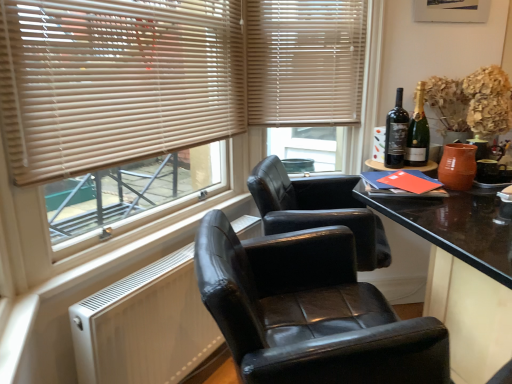
This screenshot has width=512, height=384. What are the coordinates of `beige wood blinds at upper center` in the screenshot? It's located at (305, 61).

Is beige wood blinds at upper center positioned far away from matte glass bottle at upper right, which appears as the first bottle when viewed from the right?

That's not correct — beige wood blinds at upper center is a little close to matte glass bottle at upper right, which appears as the first bottle when viewed from the right.

From the image's perspective, is beige wood blinds at upper center located above matte glass bottle at upper right, placed as the 2th bottle when sorted from left to right?

Yes, from the image's perspective, beige wood blinds at upper center is over matte glass bottle at upper right, placed as the 2th bottle when sorted from left to right.

Does point (328, 74) come closer to viewer compared to point (423, 128)?

No, (328, 74) is further to viewer.

Is beige wood blinds at upper center aimed at matte glass bottle at upper right, placed as the 2th bottle when sorted from left to right?

Yes, beige wood blinds at upper center is turned towards matte glass bottle at upper right, placed as the 2th bottle when sorted from left to right.

Is black leather chair at center to the left of beige wood blinds at upper left from the viewer's perspective?

Incorrect, black leather chair at center is not on the left side of beige wood blinds at upper left.

Which of these two, black leather chair at center or beige wood blinds at upper left, is smaller?

beige wood blinds at upper left is smaller.

Is black leather chair at center oriented away from beige wood blinds at upper left?

No, black leather chair at center is not facing away from beige wood blinds at upper left.

Which is in front, point (431, 327) or point (426, 139)?

Point (431, 327)

Between black leather chair at center and matte glass bottle at upper right, placed as the 2th bottle when sorted from left to right, which one has larger size?

black leather chair at center.

From a real-world perspective, is black leather chair at center physically below matte glass bottle at upper right, which appears as the first bottle when viewed from the right?

Yes.

Is black leather chair at center next to matte glass bottle at upper right, placed as the 2th bottle when sorted from left to right?

black leather chair at center and matte glass bottle at upper right, placed as the 2th bottle when sorted from left to right, are clearly separated.

Could you measure the distance between black glass bottle at upper right, placed as the 2th bottle when sorted from right to left, and matte glass bottle at upper right, which appears as the first bottle when viewed from the right?

They are 2.53 inches apart.

Is black glass bottle at upper right, acting as the first bottle starting from the left, placed right next to matte glass bottle at upper right, which appears as the first bottle when viewed from the right?

Absolutely, black glass bottle at upper right, acting as the first bottle starting from the left, is next to and touching matte glass bottle at upper right, which appears as the first bottle when viewed from the right.

From a real-world perspective, is black glass bottle at upper right, placed as the 2th bottle when sorted from right to left, physically below matte glass bottle at upper right, placed as the 2th bottle when sorted from left to right?

Yes, from a real-world perspective, black glass bottle at upper right, placed as the 2th bottle when sorted from right to left, is beneath matte glass bottle at upper right, placed as the 2th bottle when sorted from left to right.

Is point (400, 144) closer or farther from the camera than point (415, 135)?

Point (400, 144) is positioned closer to the camera compared to point (415, 135).

From a real-world perspective, is beige wood blinds at upper center positioned over beige wood blinds at upper left based on gravity?

Yes.

Which of these two, beige wood blinds at upper center or beige wood blinds at upper left, is bigger?

beige wood blinds at upper left is bigger.

Measure the distance between beige wood blinds at upper center and beige wood blinds at upper left.

A distance of 8.44 inches exists between beige wood blinds at upper center and beige wood blinds at upper left.

From the image's perspective, is beige wood blinds at upper center beneath beige wood blinds at upper left?

Actually, beige wood blinds at upper center appears above beige wood blinds at upper left in the image.

Based on the photo, is beige wood blinds at upper left wider or thinner than black glass bottle at upper right, acting as the first bottle starting from the left?

Considering their sizes, beige wood blinds at upper left looks slimmer than black glass bottle at upper right, acting as the first bottle starting from the left.

How different are the orientations of beige wood blinds at upper left and black glass bottle at upper right, placed as the 2th bottle when sorted from right to left, in degrees?

The angular difference between beige wood blinds at upper left and black glass bottle at upper right, placed as the 2th bottle when sorted from right to left, is 80.5 degrees.

In the scene shown: Based on their positions, is beige wood blinds at upper left located to the left or right of black glass bottle at upper right, acting as the first bottle starting from the left?

beige wood blinds at upper left is positioned on black glass bottle at upper right, acting as the first bottle starting from the left,'s left side.

Is beige wood blinds at upper left in contact with black leather chair at center?

No, beige wood blinds at upper left is not beside black leather chair at center.

From a real-world perspective, is beige wood blinds at upper left located higher than black leather chair at center?

Yes.

Considering their positions, is beige wood blinds at upper left located in front of or behind black leather chair at center?

beige wood blinds at upper left is positioned farther from the viewer than black leather chair at center.

Do you think beige wood blinds at upper left is within black leather chair at center, or outside of it?

beige wood blinds at upper left exists outside the volume of black leather chair at center.

Image resolution: width=512 pixels, height=384 pixels. In order to click on window blind behind the matte glass bottle at upper right, which appears as the first bottle when viewed from the right in this screenshot , I will do `click(305, 61)`.

Find the location of a particular element. The width and height of the screenshot is (512, 384). chair that is below the beige wood blinds at upper left (from the image's perspective) is located at coordinates (309, 311).

From the image, which object appears to be farther from black leather chair at center, beige wood blinds at upper center or black glass bottle at upper right, placed as the 2th bottle when sorted from right to left?

Among the two, beige wood blinds at upper center is located further to black leather chair at center.

Based on their spatial positions, is matte glass bottle at upper right, placed as the 2th bottle when sorted from left to right, or black leather chair at center further from black glass bottle at upper right, acting as the first bottle starting from the left?

Among the two, black leather chair at center is located further to black glass bottle at upper right, acting as the first bottle starting from the left.

Estimate the real-world distances between objects in this image. Which object is closer to matte glass bottle at upper right, placed as the 2th bottle when sorted from left to right, beige wood blinds at upper left or beige wood blinds at upper center?

beige wood blinds at upper center lies closer to matte glass bottle at upper right, placed as the 2th bottle when sorted from left to right, than the other object.

When comparing their distances from beige wood blinds at upper center, does matte glass bottle at upper right, which appears as the first bottle when viewed from the right, or black glass bottle at upper right, acting as the first bottle starting from the left, seem closer?

black glass bottle at upper right, acting as the first bottle starting from the left.

Considering their positions, is black leather chair at center positioned further to beige wood blinds at upper left than matte glass bottle at upper right, placed as the 2th bottle when sorted from left to right?

Based on the image, matte glass bottle at upper right, placed as the 2th bottle when sorted from left to right, appears to be further to beige wood blinds at upper left.

Considering their positions, is black leather chair at center positioned further to matte glass bottle at upper right, which appears as the first bottle when viewed from the right, than beige wood blinds at upper left?

The object further to matte glass bottle at upper right, which appears as the first bottle when viewed from the right, is black leather chair at center.

Considering their positions, is black glass bottle at upper right, placed as the 2th bottle when sorted from right to left, positioned further to beige wood blinds at upper left than beige wood blinds at upper center?

black glass bottle at upper right, placed as the 2th bottle when sorted from right to left, lies further to beige wood blinds at upper left than the other object.

Considering their positions, is black glass bottle at upper right, acting as the first bottle starting from the left, positioned further to black leather chair at center than matte glass bottle at upper right, which appears as the first bottle when viewed from the right?

Among the two, matte glass bottle at upper right, which appears as the first bottle when viewed from the right, is located further to black leather chair at center.

At what (x,y) coordinates should I click in order to perform the action: click on window between black leather chair at center and black glass bottle at upper right, placed as the 2th bottle when sorted from right to left, along the z-axis. Please return your answer as a coordinate pair (x, y). The width and height of the screenshot is (512, 384). Looking at the image, I should click on (163, 105).

Find the location of `bottle between beige wood blinds at upper center and matte glass bottle at upper right, which appears as the first bottle when viewed from the right`. bottle between beige wood blinds at upper center and matte glass bottle at upper right, which appears as the first bottle when viewed from the right is located at coordinates (396, 134).

In order to click on bottle between black leather chair at center and matte glass bottle at upper right, placed as the 2th bottle when sorted from left to right, from front to back in this screenshot , I will do `click(396, 134)`.

The width and height of the screenshot is (512, 384). What are the coordinates of `window located between black leather chair at center and beige wood blinds at upper center in the depth direction` in the screenshot? It's located at (163, 105).